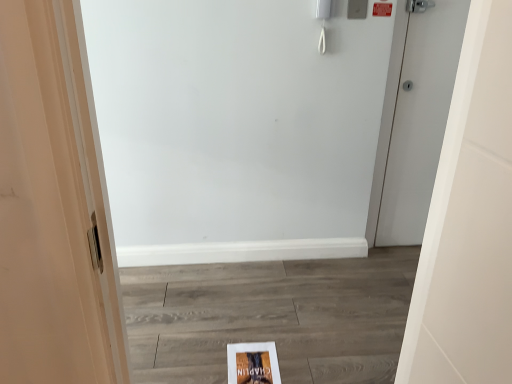
Measure the distance between point (231, 366) and camera.

Point (231, 366) is 5.77 feet away from camera.

I want to click on matte paper flyer at center, so click(253, 363).

The height and width of the screenshot is (384, 512). Describe the element at coordinates (253, 363) in the screenshot. I see `matte paper flyer at center` at that location.

Describe the element at coordinates (420, 118) in the screenshot. I see `white matte door at right` at that location.

At what (x,y) coordinates should I click in order to perform the action: click on white matte door at right. Please return your answer as a coordinate pair (x, y). This screenshot has width=512, height=384. Looking at the image, I should click on (420, 118).

Where is `matte paper flyer at center`? The height and width of the screenshot is (384, 512). matte paper flyer at center is located at coordinates (253, 363).

Does white matte door at right appear on the left side of matte paper flyer at center?

No, white matte door at right is not to the left of matte paper flyer at center.

Considering the relative positions of white matte door at right and matte paper flyer at center in the image provided, is white matte door at right in front of matte paper flyer at center?

No, it is behind matte paper flyer at center.

Is point (409, 239) closer to camera compared to point (251, 357)?

No, (409, 239) is behind (251, 357).

From the image's perspective, is white matte door at right on top of matte paper flyer at center?

Yes, from the image's perspective, white matte door at right is above matte paper flyer at center.

From a real-world perspective, between white matte door at right and matte paper flyer at center, who is vertically higher?

white matte door at right, from a real-world perspective.

Can you confirm if white matte door at right is wider than matte paper flyer at center?

In fact, white matte door at right might be narrower than matte paper flyer at center.

From the picture: Between white matte door at right and matte paper flyer at center, which one has less height?

matte paper flyer at center is shorter.

Considering the sizes of white matte door at right and matte paper flyer at center in the image, is white matte door at right bigger or smaller than matte paper flyer at center?

In the image, white matte door at right appears to be larger than matte paper flyer at center.

Is white matte door at right outside of matte paper flyer at center?

Indeed, white matte door at right is completely outside matte paper flyer at center.

Based on the photo, is white matte door at right not near matte paper flyer at center?

white matte door at right is far away from matte paper flyer at center.

Based on the photo, could you tell me if white matte door at right is turned towards matte paper flyer at center?

No, white matte door at right is not aimed at matte paper flyer at center.

How different are the orientations of white matte door at right and matte paper flyer at center in degrees?

There is a 0.427-degree angle between the facing directions of white matte door at right and matte paper flyer at center.

Measure the distance between white matte door at right and matte paper flyer at center.

white matte door at right is 1.35 meters from matte paper flyer at center.

Locate an element on the screen. This screenshot has height=384, width=512. flyer that is under the white matte door at right (from a real-world perspective) is located at coordinates (253, 363).

Is matte paper flyer at center at the left side of white matte door at right?

Yes.

Considering the relative positions of matte paper flyer at center and white matte door at right in the image provided, is matte paper flyer at center behind white matte door at right?

No, matte paper flyer at center is closer to the viewer.

Which is less distant, [250,378] or [452,80]?

The point [250,378] is more forward.

From the image's perspective, who appears lower, matte paper flyer at center or white matte door at right?

matte paper flyer at center.

Consider the image. From a real-world perspective, is matte paper flyer at center on white matte door at right?

No, from a real-world perspective, matte paper flyer at center is not above white matte door at right.

Which of these two, matte paper flyer at center or white matte door at right, is thinner?

white matte door at right is thinner.

Who is shorter, matte paper flyer at center or white matte door at right?

→ matte paper flyer at center.

Which of these two, matte paper flyer at center or white matte door at right, is smaller?

matte paper flyer at center is smaller.

Is matte paper flyer at center situated inside white matte door at right or outside?

matte paper flyer at center exists outside the volume of white matte door at right.

Is matte paper flyer at center positioned far away from white matte door at right?

Yes, matte paper flyer at center and white matte door at right are quite far apart.

Is matte paper flyer at center oriented towards white matte door at right?

No, matte paper flyer at center is not turned towards white matte door at right.

How many degrees apart are the facing directions of matte paper flyer at center and white matte door at right?

The angle between the facing direction of matte paper flyer at center and the facing direction of white matte door at right is 0.427 degrees.

Find the location of a particular element. flyer in front of the white matte door at right is located at coordinates (253, 363).

The width and height of the screenshot is (512, 384). Find the location of `flyer below the white matte door at right (from a real-world perspective)`. flyer below the white matte door at right (from a real-world perspective) is located at coordinates (253, 363).

Where is `door behind the matte paper flyer at center`? The height and width of the screenshot is (384, 512). door behind the matte paper flyer at center is located at coordinates (420, 118).